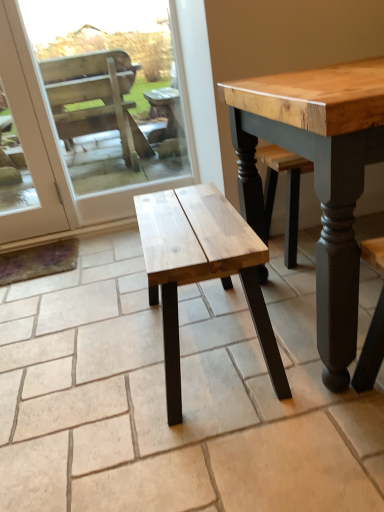
This screenshot has height=512, width=384. I want to click on vacant area situated to the left side of natural wood bench at center, so click(85, 369).